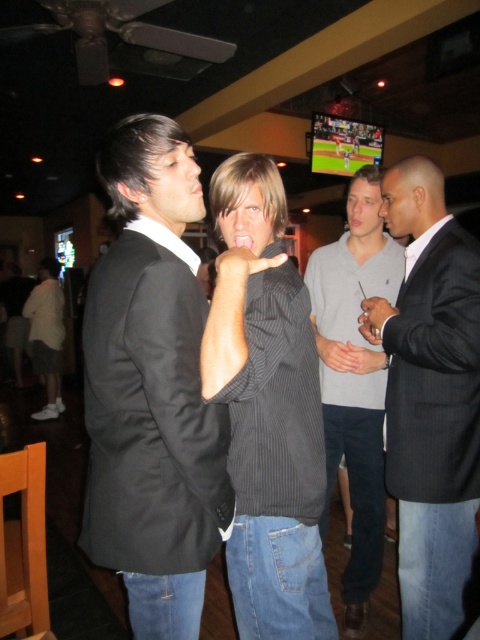
Which is more to the right, black pinstripe suit at right or dark gray pinstripe suit at right?

From the viewer's perspective, dark gray pinstripe suit at right appears more on the right side.

Who is more distant from viewer, [408,305] or [419,468]?

The point [408,305] is more distant.

Find the location of a particular element. black pinstripe suit at right is located at coordinates (431, 397).

From the picture: Who is more distant from viewer, (375, 424) or (35, 301)?

The point (35, 301) is more distant.

Is gray cotton sweater at center smaller than white cotton shirt at lower left?

Indeed, gray cotton sweater at center has a smaller size compared to white cotton shirt at lower left.

At what (x,y) coordinates should I click in order to perform the action: click on gray cotton sweater at center. Please return your answer as a coordinate pair (x, y). Looking at the image, I should click on (355, 378).

Does point (124, 497) come closer to viewer compared to point (36, 413)?

Yes, point (124, 497) is closer to viewer.

At what (x,y) coordinates should I click in order to perform the action: click on black matte suit at center. Please return your answer as a coordinate pair (x, y). The width and height of the screenshot is (480, 640). Looking at the image, I should click on [x=152, y=387].